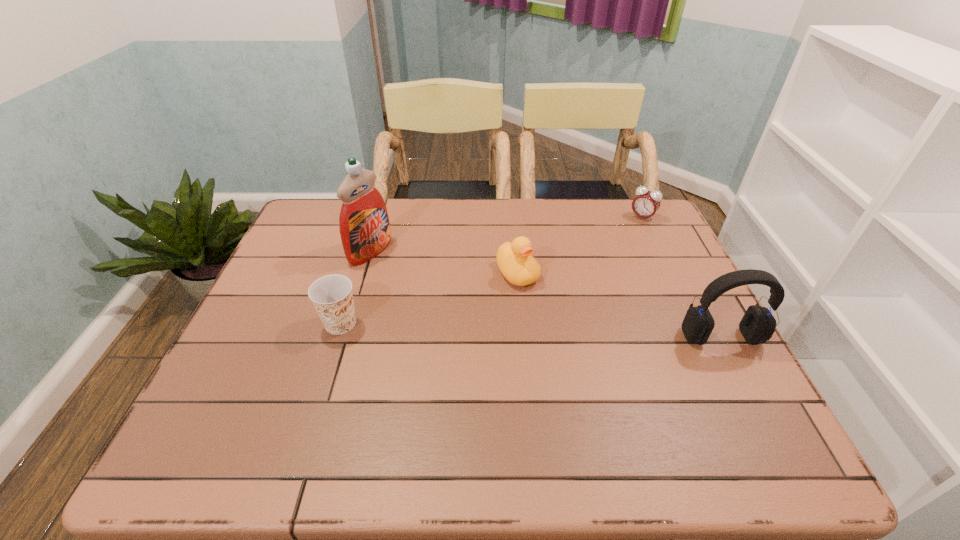
At what (x,y) coordinates should I click in order to perform the action: click on Dixie cup. Please return your answer as a coordinate pair (x, y). This screenshot has width=960, height=540. Looking at the image, I should click on (332, 296).

This screenshot has width=960, height=540. What are the coordinates of `the fourth shortest object` in the screenshot? It's located at (758, 324).

Locate an element on the screen. duck is located at coordinates (514, 260).

The width and height of the screenshot is (960, 540). Identify the location of alarm clock. (646, 203).

Where is `detergent`? detergent is located at coordinates (364, 226).

The height and width of the screenshot is (540, 960). Identify the location of vacant space situated 0.100m on the left of the Dixie cup. (279, 323).

Where is `vacant space located on the headband of the fourth shortest object`? The height and width of the screenshot is (540, 960). vacant space located on the headband of the fourth shortest object is located at coordinates (750, 392).

Image resolution: width=960 pixels, height=540 pixels. I want to click on free spot located 0.370m on the face of the duck, so click(x=624, y=396).

Identify the location of free region located on the face of the duck. The height and width of the screenshot is (540, 960). (597, 366).

Where is `free spot located 0.200m on the face of the duck`? free spot located 0.200m on the face of the duck is located at coordinates (575, 341).